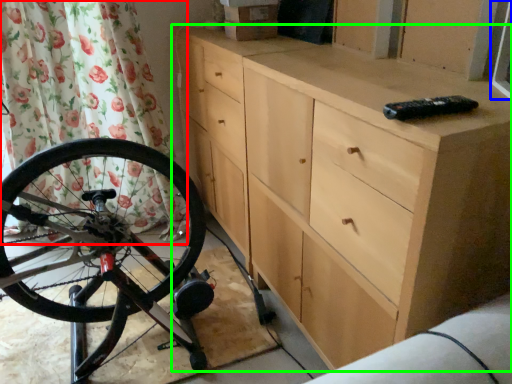
Question: Estimate the real-world distances between objects in this image. Which object is farther from shower curtain (highlighted by a red box), window screen (highlighted by a blue box) or chest of drawers (highlighted by a green box)?

Choices:
 (A) window screen
 (B) chest of drawers

Answer: (A)